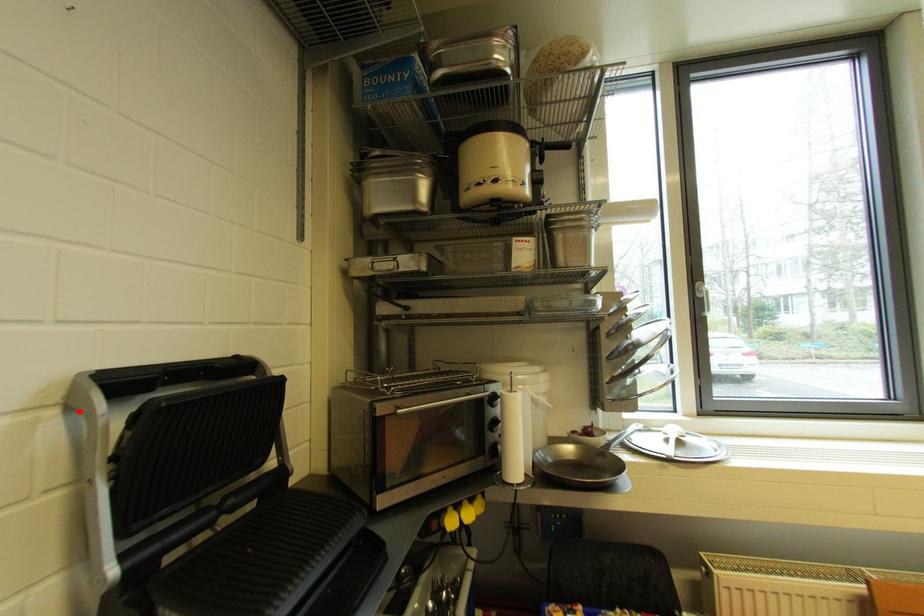
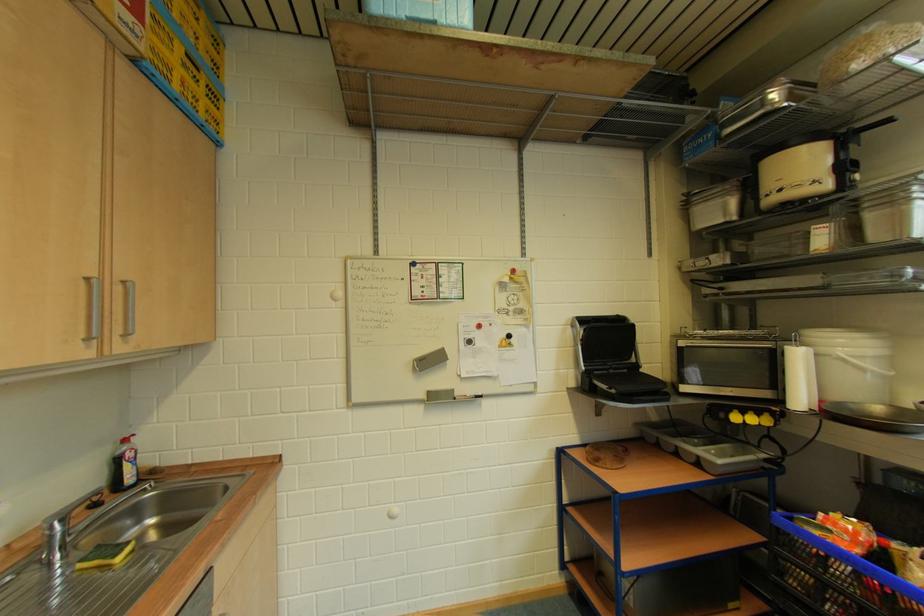
Locate, in the second image, the point that corresponds to the highlighted location in the first image.

(579, 329)